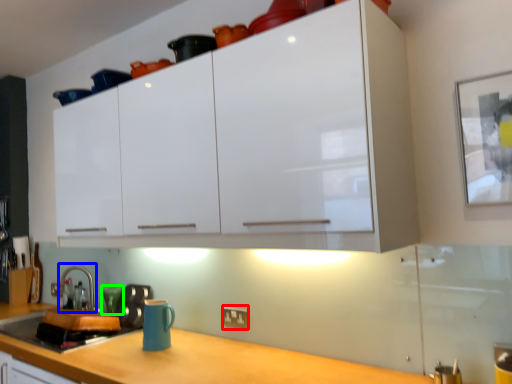
Question: Based on their relative distances, which object is farther from electric outlet (highlighted by a red box)? Choose from faucet (highlighted by a blue box) and teal (highlighted by a green box).

Choices:
 (A) faucet
 (B) teal

Answer: (A)